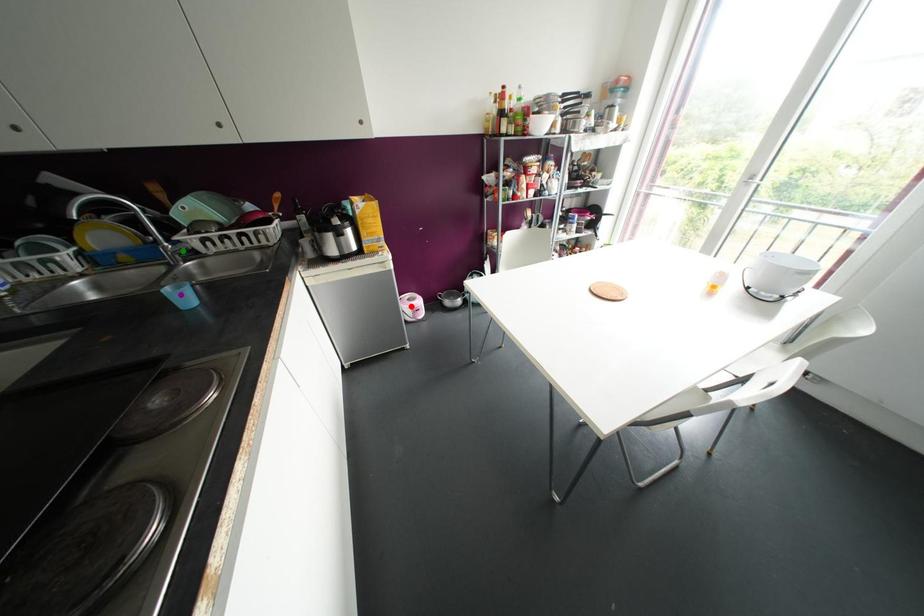
Order these from nearest to farthest:
1. red point
2. green point
3. purple point

1. purple point
2. green point
3. red point